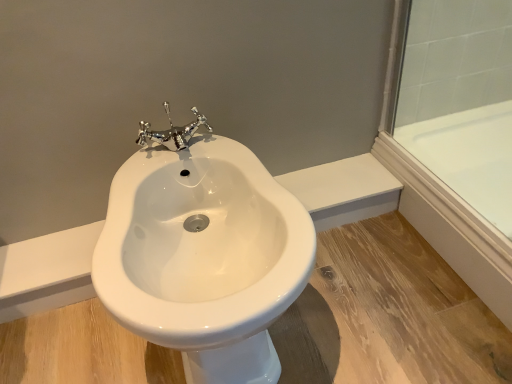
This screenshot has height=384, width=512. I want to click on vacant point above transparent glass door at upper right (from a real-world perspective), so click(446, 186).